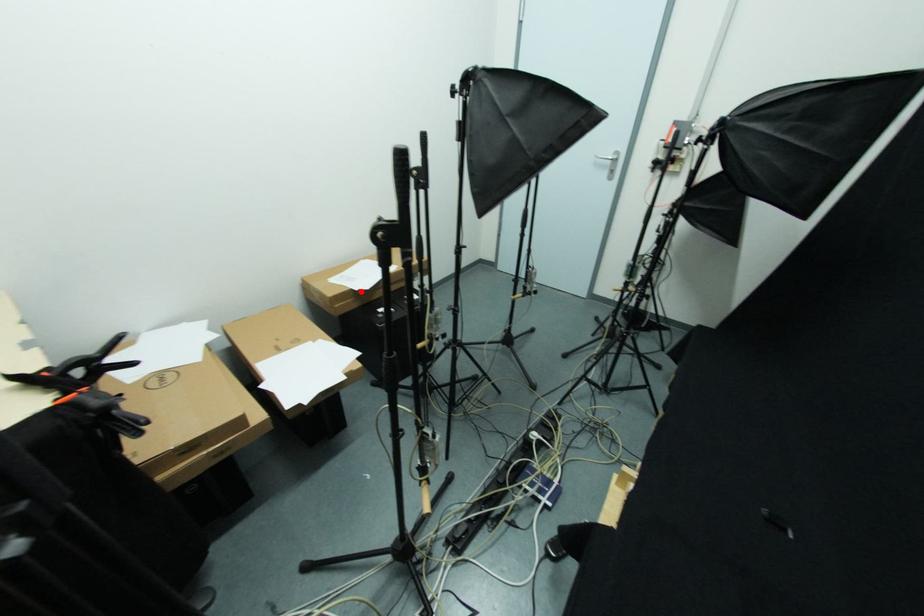
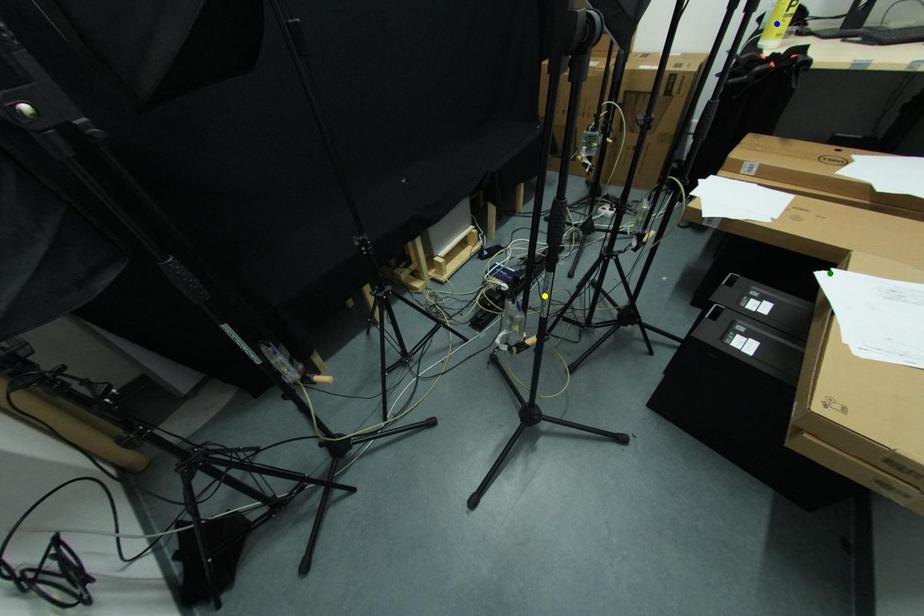
Question: I am providing you with two images of the same scene from different viewpoints. A red point is marked on the first image. You are given multiple points on the second image. Can you choose the point in image 2 that corresponds to the point in image 1?

Choices:
 (A) green point
 (B) yellow point
 (C) blue point

Answer: (A)